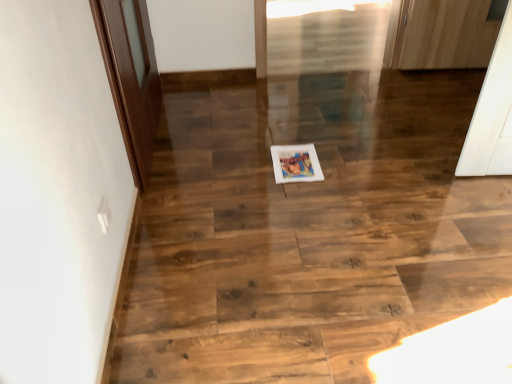
This screenshot has width=512, height=384. Identify the location of vacant space in brown wooden door at left (from a real-world perspective). [159, 135].